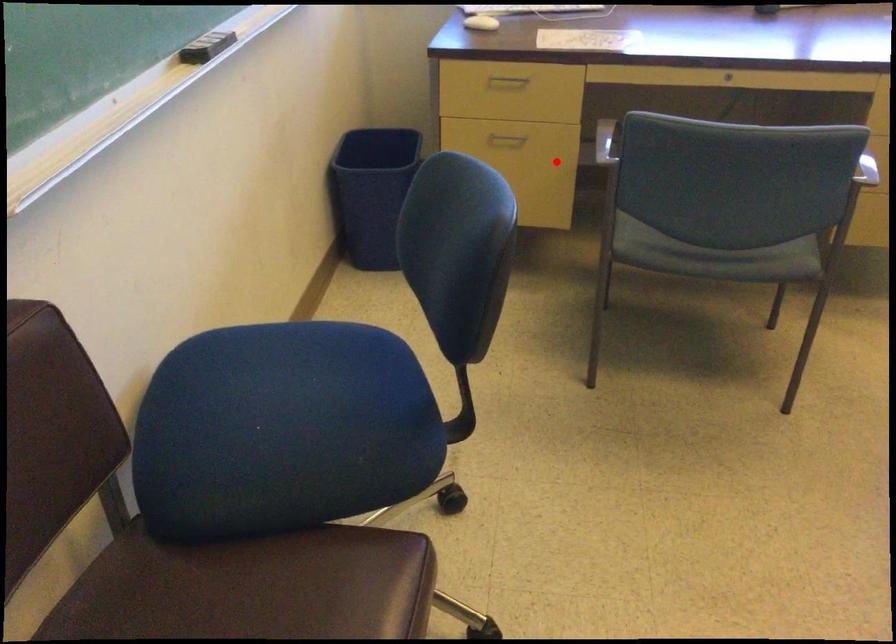
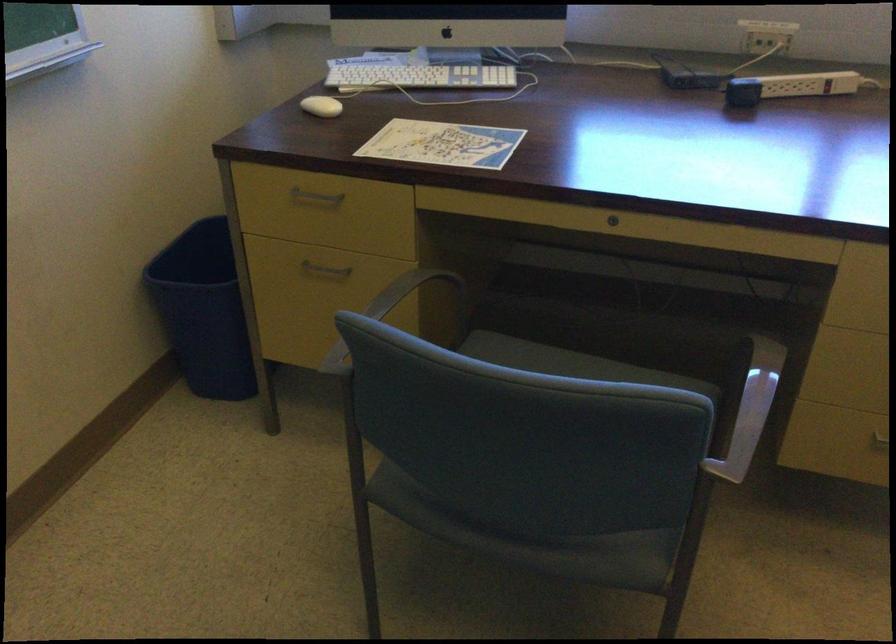
Question: I am providing you with two images of the same scene from different viewpoints. Image1 has a red point marked. In image2, the corresponding 3D location appears at what relative position? Reply with the corresponding letter.

Choices:
 (A) Closer
 (B) Farther

Answer: (A)